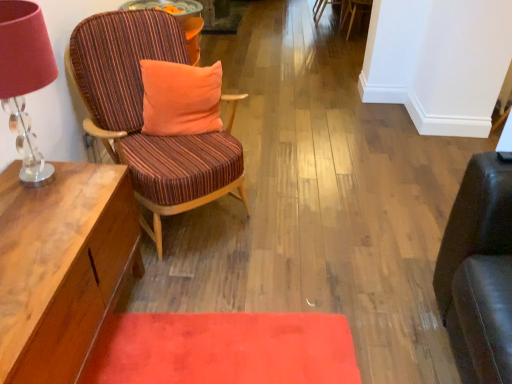
Identify the location of free space above velvety red mat at lower center (from a real-world perspective). This screenshot has height=384, width=512. (213, 356).